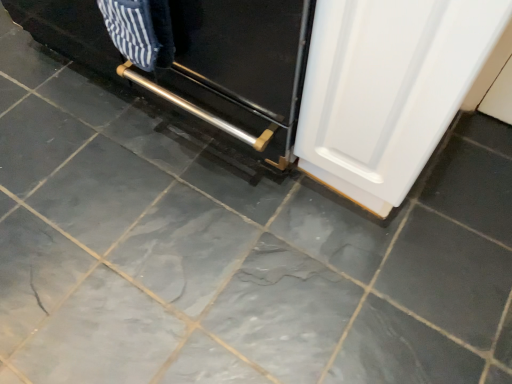
Question: From a real-world perspective, is white glossy door at lower right on metallic silver oven at center?

Choices:
 (A) yes
 (B) no

Answer: (A)

Question: Is white glossy door at lower right at the right side of metallic silver oven at center?

Choices:
 (A) yes
 (B) no

Answer: (A)

Question: Is white glossy door at lower right positioned beyond the bounds of metallic silver oven at center?

Choices:
 (A) yes
 (B) no

Answer: (A)

Question: From a real-world perspective, is white glossy door at lower right beneath metallic silver oven at center?

Choices:
 (A) yes
 (B) no

Answer: (B)

Question: Does white glossy door at lower right have a smaller size compared to metallic silver oven at center?

Choices:
 (A) yes
 (B) no

Answer: (A)

Question: Does white glossy door at lower right appear on the left side of metallic silver oven at center?

Choices:
 (A) yes
 (B) no

Answer: (B)

Question: Is metallic silver oven at center closer to camera compared to white glossy door at lower right?

Choices:
 (A) no
 (B) yes

Answer: (A)

Question: Could white glossy door at lower right be considered to be inside metallic silver oven at center?

Choices:
 (A) no
 (B) yes

Answer: (A)

Question: Does metallic silver oven at center have a larger size compared to white glossy door at lower right?

Choices:
 (A) yes
 (B) no

Answer: (A)

Question: Can you confirm if metallic silver oven at center is smaller than white glossy door at lower right?

Choices:
 (A) yes
 (B) no

Answer: (B)

Question: From a real-world perspective, does metallic silver oven at center sit lower than white glossy door at lower right?

Choices:
 (A) no
 (B) yes

Answer: (B)

Question: Could you tell me if metallic silver oven at center is turned towards white glossy door at lower right?

Choices:
 (A) no
 (B) yes

Answer: (A)

Question: Is white glossy door at lower right to the left or to the right of metallic silver oven at center in the image?

Choices:
 (A) right
 (B) left

Answer: (A)